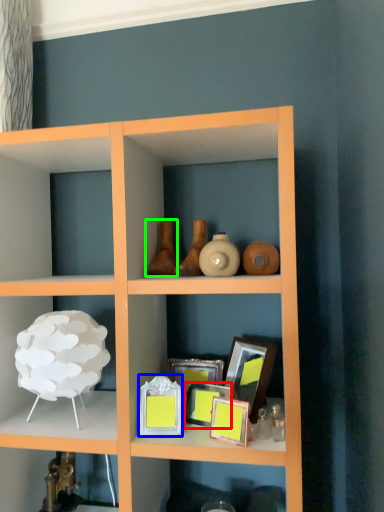
Question: Estimate the real-world distances between objects in this image. Which object is closer to picture frame (highlighted by a red box), picture frame (highlighted by a blue box) or vase (highlighted by a green box)?

Choices:
 (A) picture frame
 (B) vase

Answer: (A)